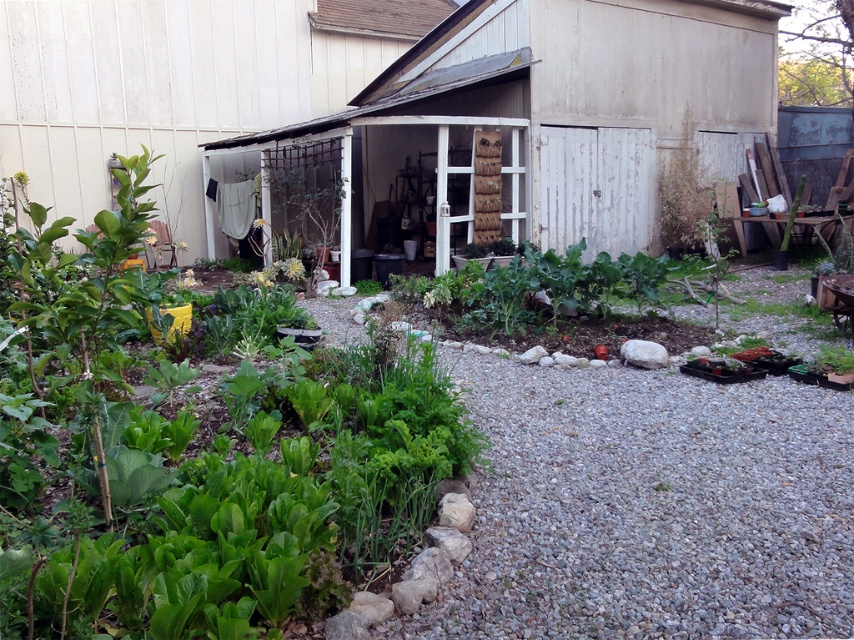
Question: Among these objects, which one is nearest to the camera?

Choices:
 (A) white wood shed at center
 (B) white wooden shed at center

Answer: (B)

Question: Where is white wooden shed at center located in relation to white wood shed at center in the image?

Choices:
 (A) above
 (B) below

Answer: (B)

Question: Does white wooden shed at center come in front of white wood shed at center?

Choices:
 (A) yes
 (B) no

Answer: (A)

Question: Which of the following is the closest to the observer?

Choices:
 (A) white wood shed at center
 (B) white wooden shed at center

Answer: (B)

Question: Observing the image, what is the correct spatial positioning of white wooden shed at center in reference to white wood shed at center?

Choices:
 (A) left
 (B) right

Answer: (B)